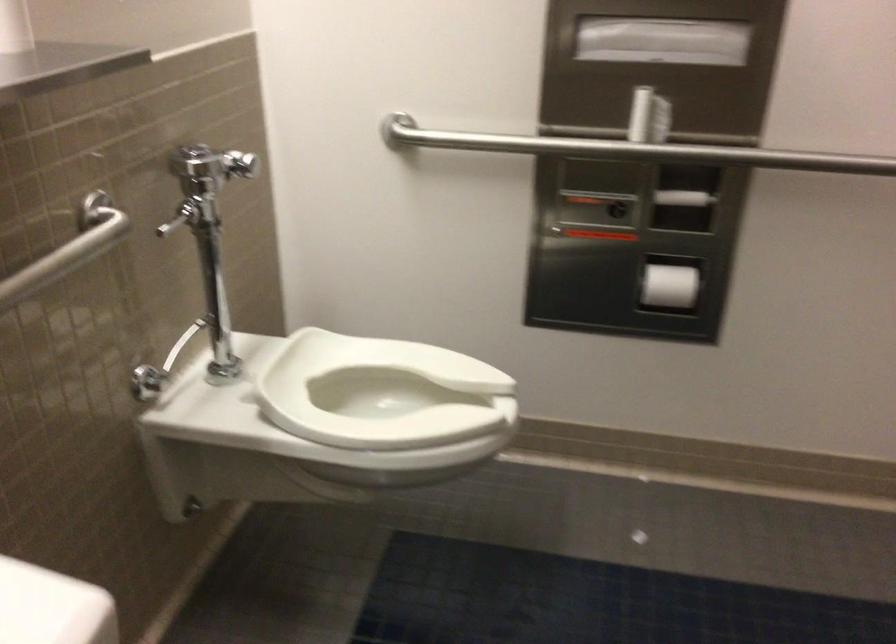
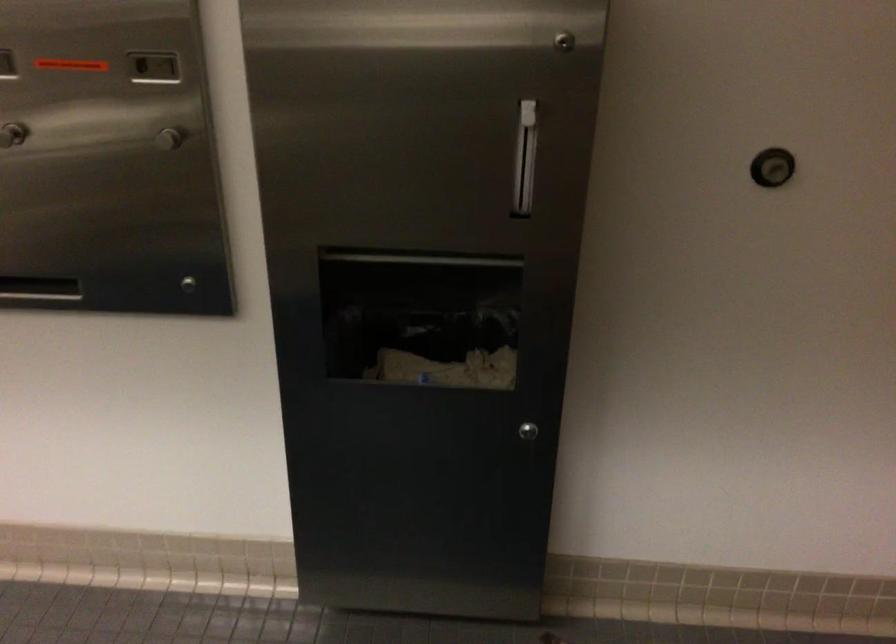
First-person continuous shooting, in which direction is the camera rotating?

The rotation direction of the camera is right-down.